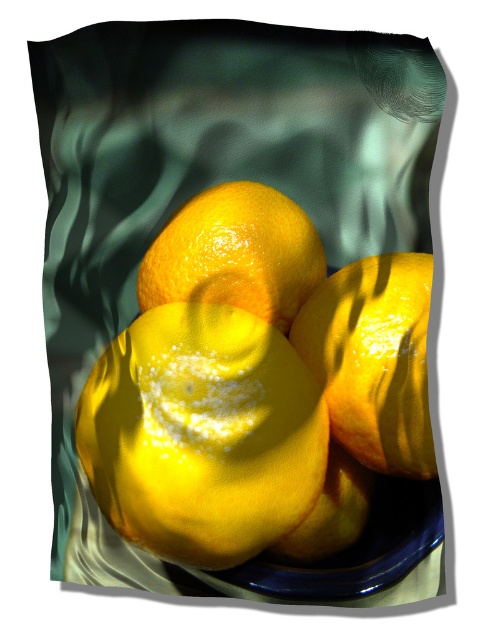
Question: Is glossy yellow lemon at center wider than shiny yellow lemon at center?

Choices:
 (A) yes
 (B) no

Answer: (A)

Question: Can you confirm if shiny yellow lemon at center is positioned below glossy citrus fruit at center?

Choices:
 (A) no
 (B) yes

Answer: (B)

Question: Does glossy yellow lemon at center have a smaller size compared to glossy yellow tangerine at center?

Choices:
 (A) no
 (B) yes

Answer: (A)

Question: Which object is the closest to the shiny yellow lemon at center?

Choices:
 (A) glossy citrus fruit at center
 (B) glossy yellow lemon at center

Answer: (B)

Question: Among these objects, which one is farthest from the camera?

Choices:
 (A) glossy yellow lemon at center
 (B) glossy yellow tangerine at center
 (C) shiny yellow lemon at center
 (D) glossy citrus fruit at center

Answer: (B)

Question: Which of the following is the closest to the observer?

Choices:
 (A) glossy yellow tangerine at center
 (B) shiny yellow lemon at center
 (C) glossy citrus fruit at center
 (D) glossy yellow lemon at center

Answer: (D)